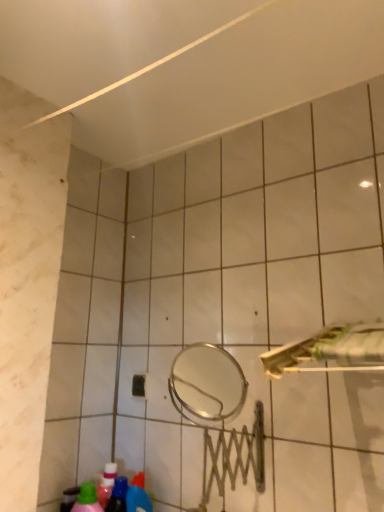
The height and width of the screenshot is (512, 384). Identify the location of blue glossy bottle at lower left. (138, 495).

What do you see at coordinates (138, 495) in the screenshot? I see `blue glossy bottle at lower left` at bounding box center [138, 495].

Locate an element on the screen. blue glossy bottle at lower left is located at coordinates (138, 495).